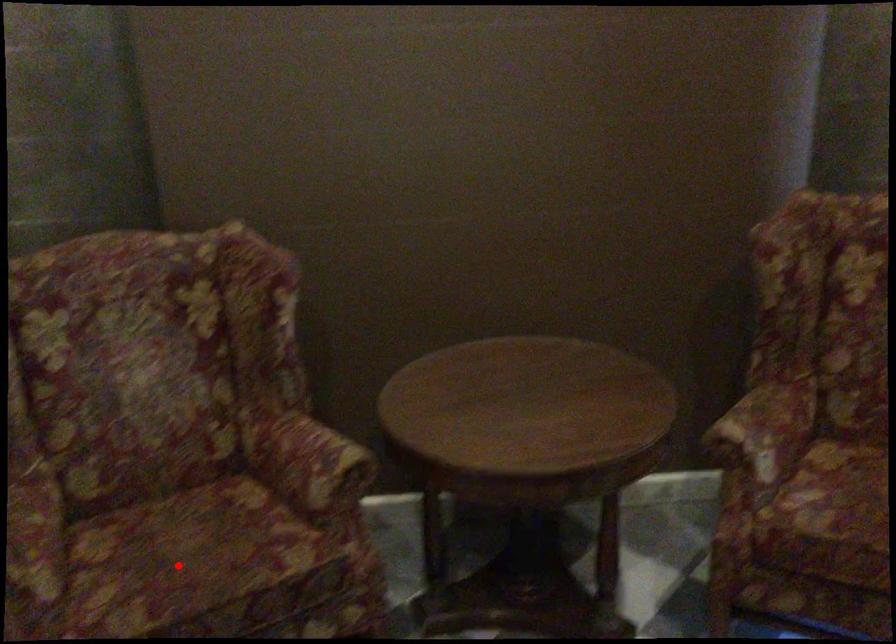
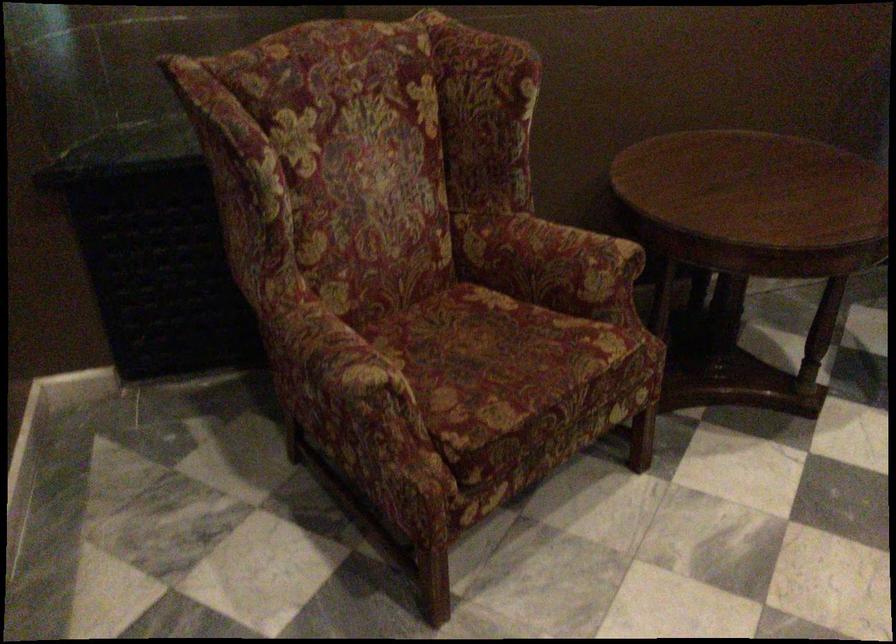
Find the pixel in the second image that matches the highlighted location in the first image.

(495, 363)